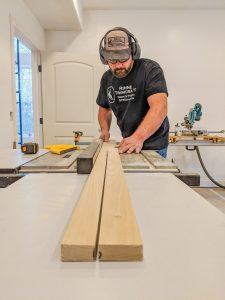
Find the location of a particular element. door hinges is located at coordinates (39, 69), (41, 120).